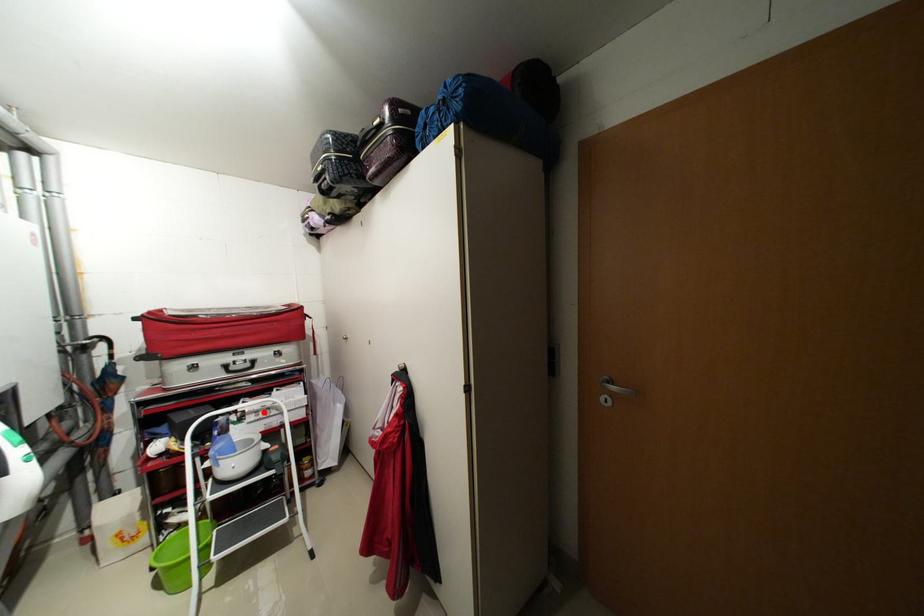
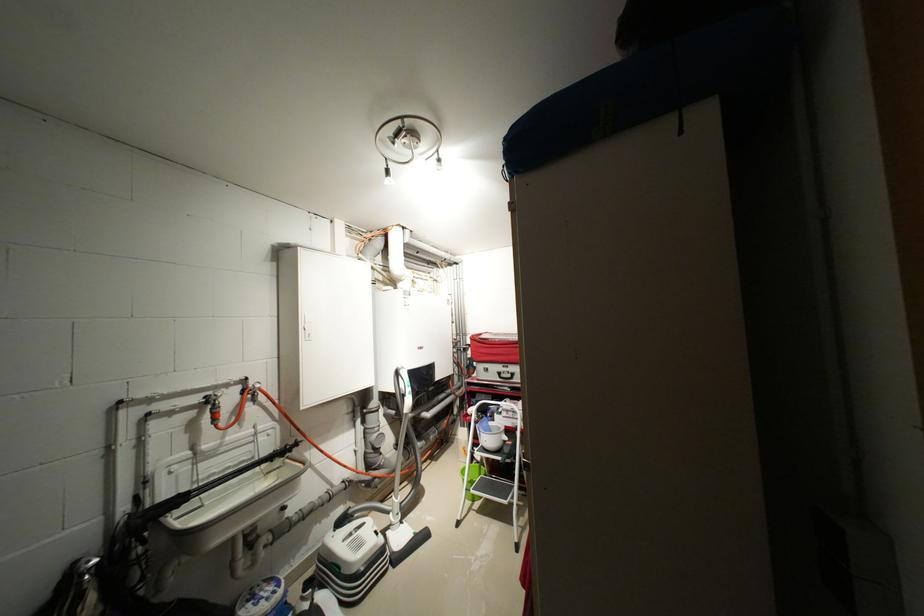
Question: I am providing you with two images of the same scene from different viewpoints. A red point is shown in image1. For the corresponding object point in image2, is it positioned nearer or farther from the camera?

Choices:
 (A) Nearer
 (B) Farther

Answer: (B)